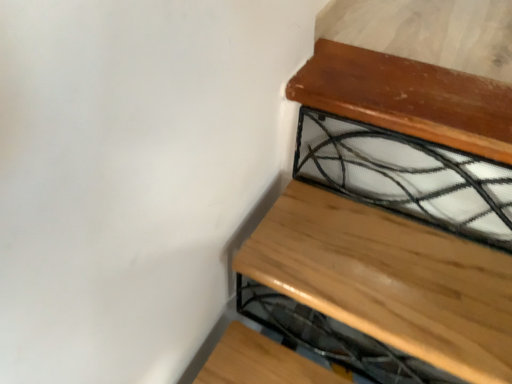
What do you see at coordinates (389, 279) in the screenshot? I see `natural wood stair at upper right` at bounding box center [389, 279].

Measure the distance between natural wood stair at upper right and camera.

natural wood stair at upper right is 27.35 inches from camera.

Locate an element on the screen. natural wood stair at upper right is located at coordinates (389, 279).

Locate an element on the screen. clear glass at upper right is located at coordinates (407, 176).

The width and height of the screenshot is (512, 384). What do you see at coordinates (407, 176) in the screenshot? I see `clear glass at upper right` at bounding box center [407, 176].

What is the approximate height of clear glass at upper right?

The height of clear glass at upper right is 12.03 inches.

Locate an element on the screen. This screenshot has height=384, width=512. natural wood stair at upper right is located at coordinates 389,279.

Does natural wood stair at upper right appear on the right side of clear glass at upper right?

In fact, natural wood stair at upper right is to the left of clear glass at upper right.

Is natural wood stair at upper right positioned before clear glass at upper right?

Yes, it is in front of clear glass at upper right.

Which is farther from the camera, (347,277) or (398,201)?

Point (398,201)

Consider the image. From the image's perspective, does natural wood stair at upper right appear higher than clear glass at upper right?

Incorrect, from the image's perspective, natural wood stair at upper right is lower than clear glass at upper right.

Looking at this image, from a real-world perspective, who is located higher, natural wood stair at upper right or clear glass at upper right?

From a 3D spatial view, clear glass at upper right is above.

Is natural wood stair at upper right thinner than clear glass at upper right?

Incorrect, the width of natural wood stair at upper right is not less than that of clear glass at upper right.

Is natural wood stair at upper right shorter than clear glass at upper right?

Yes.

Looking at the image, does natural wood stair at upper right seem bigger or smaller compared to clear glass at upper right?

Clearly, natural wood stair at upper right is larger in size than clear glass at upper right.

Is natural wood stair at upper right completely or partially outside of clear glass at upper right?

natural wood stair at upper right is positioned outside clear glass at upper right.

Would you say natural wood stair at upper right is a long distance from clear glass at upper right?

No, natural wood stair at upper right is not far from clear glass at upper right.

Is natural wood stair at upper right facing away from clear glass at upper right?

No, natural wood stair at upper right's orientation is not away from clear glass at upper right.

What's the angular difference between natural wood stair at upper right and clear glass at upper right's facing directions?

They differ by 0.000271 degrees in their facing directions.

Measure the distance from natural wood stair at upper right to clear glass at upper right.

natural wood stair at upper right is 5.49 inches away from clear glass at upper right.

Image resolution: width=512 pixels, height=384 pixels. I want to click on furniture beneath the clear glass at upper right (from a real-world perspective), so click(x=389, y=279).

Does clear glass at upper right appear on the left side of natural wood stair at upper right?

In fact, clear glass at upper right is to the right of natural wood stair at upper right.

Relative to natural wood stair at upper right, is clear glass at upper right in front or behind?

clear glass at upper right is positioned farther from the viewer than natural wood stair at upper right.

Is point (389, 139) positioned after point (479, 297)?

Yes, it is.

Looking at this image, from the image's perspective, would you say clear glass at upper right is shown under natural wood stair at upper right?

No, from the image's perspective, clear glass at upper right is not below natural wood stair at upper right.

From a real-world perspective, is clear glass at upper right located beneath natural wood stair at upper right?

No, from a real-world perspective, clear glass at upper right is not beneath natural wood stair at upper right.

In terms of width, does clear glass at upper right look wider or thinner when compared to natural wood stair at upper right?

In the image, clear glass at upper right appears to be more narrow than natural wood stair at upper right.

Considering the sizes of clear glass at upper right and natural wood stair at upper right in the image, is clear glass at upper right taller or shorter than natural wood stair at upper right?

Considering their sizes, clear glass at upper right has more height than natural wood stair at upper right.

Based on their sizes in the image, would you say clear glass at upper right is bigger or smaller than natural wood stair at upper right?

Considering their sizes, clear glass at upper right takes up less space than natural wood stair at upper right.

Is clear glass at upper right inside or outside of natural wood stair at upper right?

clear glass at upper right is located beyond the bounds of natural wood stair at upper right.

Consider the image. Is clear glass at upper right beside natural wood stair at upper right?

clear glass at upper right and natural wood stair at upper right are not in contact.

Does clear glass at upper right turn towards natural wood stair at upper right?

No, clear glass at upper right is not facing towards natural wood stair at upper right.

I want to click on glass window behind the natural wood stair at upper right, so click(x=407, y=176).

You are a GUI agent. You are given a task and a screenshot of the screen. Output one action in this format:
    pyautogui.click(x=<x>, y=<y>)
    Task: Click on the glass window above the natural wood stair at upper right (from a real-world perspective)
    The width and height of the screenshot is (512, 384).
    Given the screenshot: What is the action you would take?
    pyautogui.click(x=407, y=176)

Locate an element on the screen. This screenshot has width=512, height=384. furniture below the clear glass at upper right (from the image's perspective) is located at coordinates (389, 279).